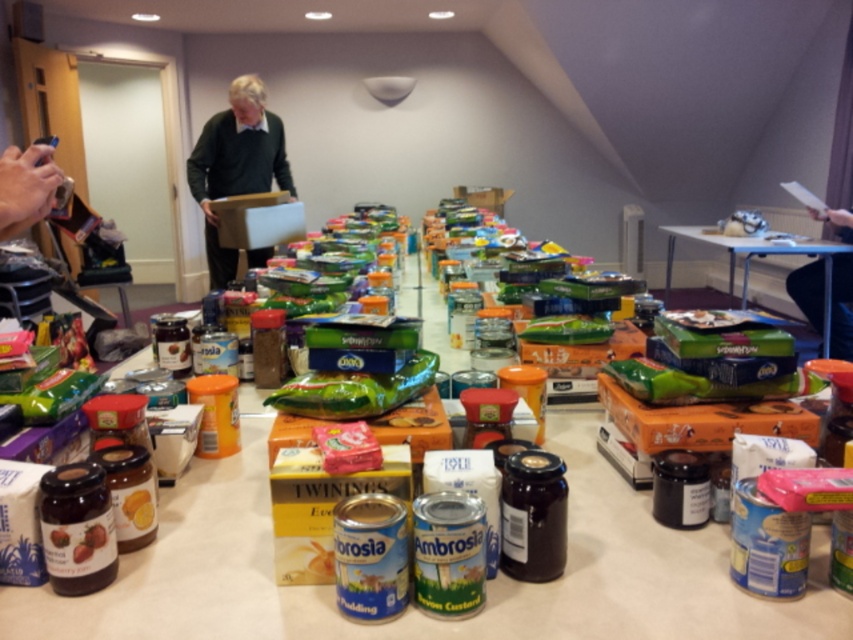
You are organizing a food drive and need to place a new item on the table. The green sweater at center and the green matte bag at center are already on the table. Which one takes up more space?

The green sweater at center is larger in size than the green matte bag at center, so it takes up more space.